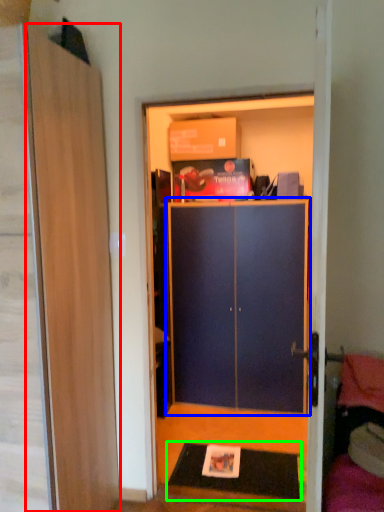
Question: Which is nearer to the door (highlighted by a red box)? cabinetry (highlighted by a blue box) or doormat (highlighted by a green box).

Choices:
 (A) cabinetry
 (B) doormat

Answer: (B)